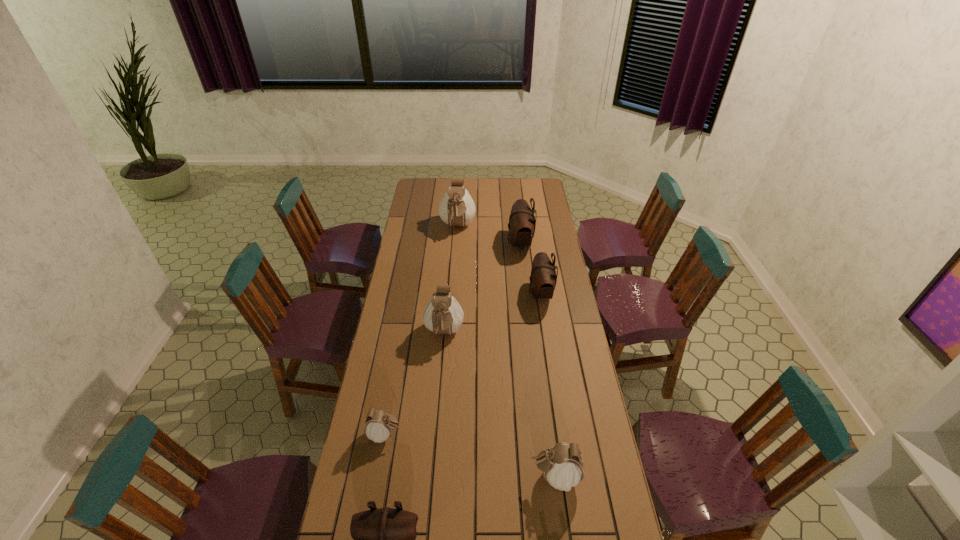
Identify the location of free space between the biggest white pouch and the shortest object. (421, 330).

You are a GUI agent. You are given a task and a screenshot of the screen. Output one action in this format:
    pyautogui.click(x=<x>, y=<y>)
    Task: Click on the empty space between the biggest brown pouch and the third nearest object
    
    Given the screenshot: What is the action you would take?
    (452, 339)

Identify the location of object that ranks as the closest to the biggest brown pouch. Image resolution: width=960 pixels, height=540 pixels. (543, 278).

Locate an element on the screen. This screenshot has height=540, width=960. object that ranks as the fifth closest to the nearest object is located at coordinates (522, 222).

Identify which pouch is the second closest to the shortest object. Please provide its 2D coordinates. Your answer should be formatted as a tuple, i.e. [(x, y)], where the tuple contains the x and y coordinates of a point satisfying the conditions above.

[(442, 315)]

Where is `pouch that is the second nearest to the third farthest object`? pouch that is the second nearest to the third farthest object is located at coordinates [442, 315].

Identify which white pouch is the nearest to the second smallest white pouch. Please provide its 2D coordinates. Your answer should be formatted as a tuple, i.e. [(x, y)], where the tuple contains the x and y coordinates of a point satisfying the conditions above.

[(378, 427)]

You are a GUI agent. You are given a task and a screenshot of the screen. Output one action in this format:
    pyautogui.click(x=<x>, y=<y>)
    Task: Click on the white pouch that is the third nearest to the smallest white pouch
    This screenshot has width=960, height=540.
    Given the screenshot: What is the action you would take?
    pyautogui.click(x=457, y=208)

Locate an element on the screen. This screenshot has height=540, width=960. brown pouch that can be found as the closest to the fourth farthest object is located at coordinates (543, 278).

Where is `brown pouch that can be found as the second closest to the fourth nearest pouch`? The image size is (960, 540). brown pouch that can be found as the second closest to the fourth nearest pouch is located at coordinates (522, 222).